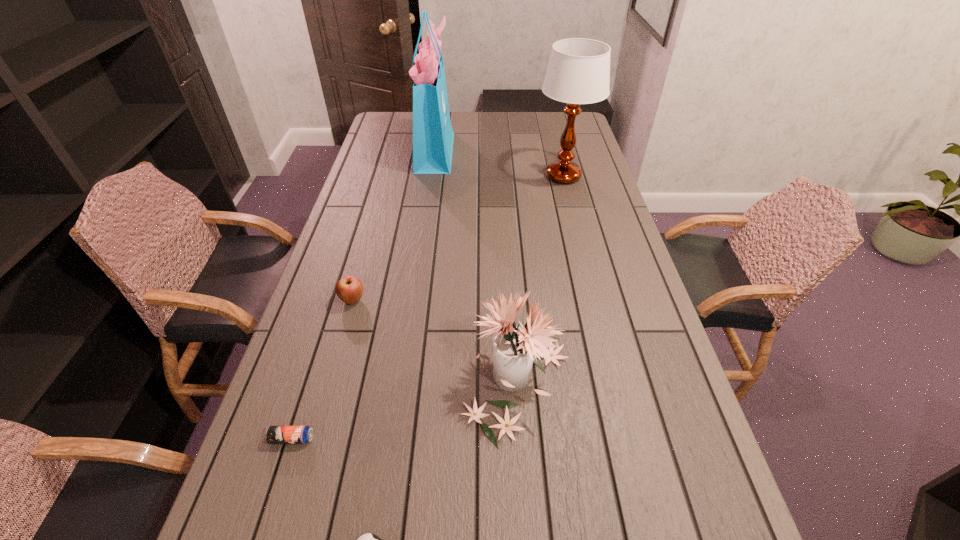
What are the coordinates of `shopping bag` in the screenshot? It's located at (433, 136).

The height and width of the screenshot is (540, 960). What are the coordinates of `table lamp` in the screenshot? It's located at (578, 72).

Find the location of a particular element. Image resolution: width=960 pixels, height=540 pixels. bouquet is located at coordinates (515, 349).

Where is `the fourth tallest object`? the fourth tallest object is located at coordinates (349, 289).

The height and width of the screenshot is (540, 960). In order to click on apple in this screenshot , I will do `click(349, 289)`.

You are a GUI agent. You are given a task and a screenshot of the screen. Output one action in this format:
    pyautogui.click(x=<x>, y=<y>)
    Task: Click on the beer can
    The image size is (960, 540).
    Given the screenshot: What is the action you would take?
    pyautogui.click(x=274, y=434)

Locate an element on the screen. This screenshot has height=540, width=960. vacant space located 0.090m on the back of the shopping bag is located at coordinates (440, 122).

The height and width of the screenshot is (540, 960). I want to click on free space located on the back of the table lamp, so click(x=550, y=124).

Locate an element on the screen. free space located 0.310m on the left of the bouquet is located at coordinates (326, 387).

This screenshot has width=960, height=540. In order to click on vacant region located on the front of the third farthest object in this screenshot , I will do `click(324, 400)`.